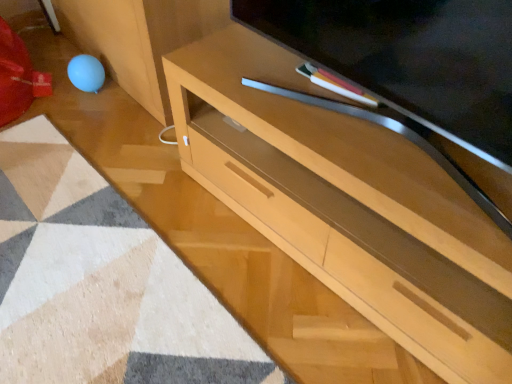
Question: Considering the relative sizes of matte wood television at center and beige textured mat at lower left in the image provided, is matte wood television at center bigger than beige textured mat at lower left?

Choices:
 (A) no
 (B) yes

Answer: (B)

Question: From a real-world perspective, is matte wood television at center under beige textured mat at lower left?

Choices:
 (A) no
 (B) yes

Answer: (A)

Question: Does matte wood television at center appear on the left side of beige textured mat at lower left?

Choices:
 (A) yes
 (B) no

Answer: (B)

Question: Is matte wood television at center far away from beige textured mat at lower left?

Choices:
 (A) yes
 (B) no

Answer: (B)

Question: Is matte wood television at center surrounding beige textured mat at lower left?

Choices:
 (A) no
 (B) yes

Answer: (A)

Question: Considering the relative sizes of matte wood television at center and beige textured mat at lower left in the image provided, is matte wood television at center smaller than beige textured mat at lower left?

Choices:
 (A) yes
 (B) no

Answer: (B)

Question: From the image's perspective, is matte wood television at center located above light wood desk at center?

Choices:
 (A) no
 (B) yes

Answer: (B)

Question: Is light wood desk at center a part of matte wood television at center?

Choices:
 (A) no
 (B) yes

Answer: (A)

Question: Considering the relative sizes of matte wood television at center and light wood desk at center in the image provided, is matte wood television at center thinner than light wood desk at center?

Choices:
 (A) no
 (B) yes

Answer: (B)

Question: Is matte wood television at center shorter than light wood desk at center?

Choices:
 (A) yes
 (B) no

Answer: (A)

Question: Can you confirm if matte wood television at center is taller than light wood desk at center?

Choices:
 (A) no
 (B) yes

Answer: (A)

Question: Is matte wood television at center aimed at light wood desk at center?

Choices:
 (A) yes
 (B) no

Answer: (B)

Question: Could matte wood television at center be considered to be inside light wood desk at center?

Choices:
 (A) no
 (B) yes

Answer: (A)